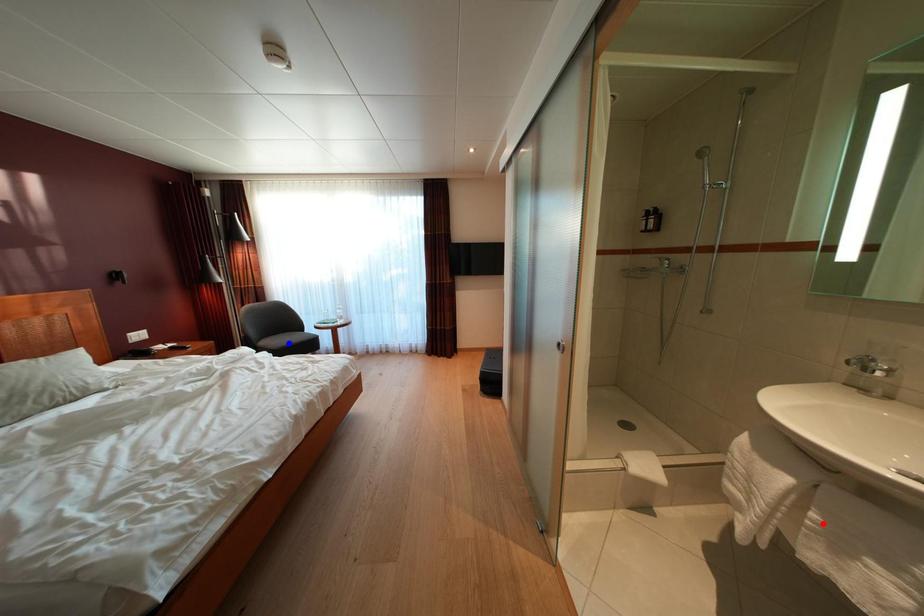
Question: Two points are marked on the image. Which point is closer to the camera?

Choices:
 (A) Blue point is closer.
 (B) Red point is closer.

Answer: (B)